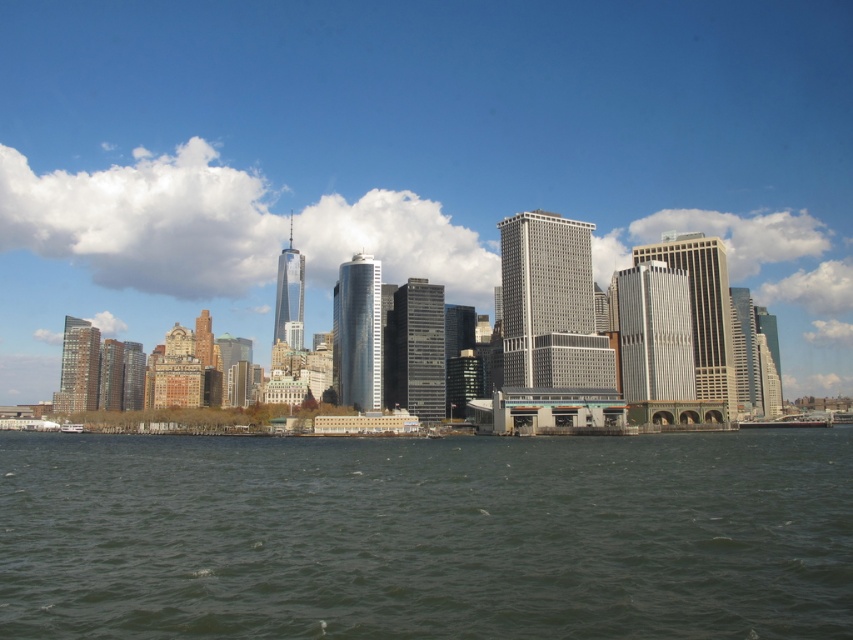
Question: Which object is positioned closest to the transparent glass buildings at center?

Choices:
 (A) white plastic boat at lower left
 (B) white glossy boat at lower right

Answer: (B)

Question: Which is farther from the greenish water at lower center?

Choices:
 (A) white plastic boat at lower left
 (B) white glossy boat at lower right
 (C) transparent glass buildings at center

Answer: (C)

Question: Which object appears closest to the camera in this image?

Choices:
 (A) transparent glass buildings at center
 (B) white glossy boat at lower right

Answer: (A)

Question: Does transparent glass buildings at center have a smaller size compared to white plastic boat at lower left?

Choices:
 (A) yes
 (B) no

Answer: (B)

Question: Does white glossy boat at lower right have a greater width compared to white plastic boat at lower left?

Choices:
 (A) no
 (B) yes

Answer: (B)

Question: Is transparent glass buildings at center to the left of white plastic boat at lower left from the viewer's perspective?

Choices:
 (A) no
 (B) yes

Answer: (A)